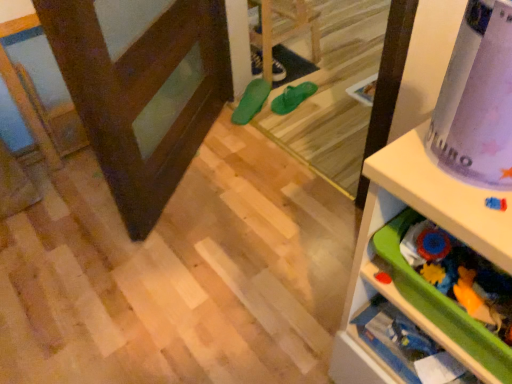
Image resolution: width=512 pixels, height=384 pixels. Describe the element at coordinates (140, 95) in the screenshot. I see `dark brown wood screen door at left` at that location.

Where is `green rubber flip-flops at center`? green rubber flip-flops at center is located at coordinates (281, 35).

What are the coordinates of `dark brown wood screen door at left` in the screenshot? It's located at (140, 95).

Is dark brown wood screen door at left facing away from green plastic drawer at lower right, which is counted as the 2th shelf, starting from the front?

dark brown wood screen door at left does not have its back to green plastic drawer at lower right, which is counted as the 2th shelf, starting from the front.

Between dark brown wood screen door at left and green plastic drawer at lower right, which is counted as the 2th shelf, starting from the front, which one appears on the left side from the viewer's perspective?

dark brown wood screen door at left is more to the left.

In terms of height, does dark brown wood screen door at left look taller or shorter compared to green plastic drawer at lower right, which appears as the 1th shelf when viewed from the back?

dark brown wood screen door at left is taller than green plastic drawer at lower right, which appears as the 1th shelf when viewed from the back.

Are dark brown wood screen door at left and green plastic drawer at lower right, which appears as the 1th shelf when viewed from the back, far apart?

dark brown wood screen door at left is actually quite close to green plastic drawer at lower right, which appears as the 1th shelf when viewed from the back.

From a real-world perspective, which object stands above the other?

purple matte wrapping paper at upper right is physically above.

Considering the points (453, 159) and (362, 239), which point is in front, point (453, 159) or point (362, 239)?

The point (453, 159) is in front.

From the image's perspective, is purple matte wrapping paper at upper right located beneath white plastic shelf at upper right, which appears as the second shelf when viewed from the back?

Actually, purple matte wrapping paper at upper right appears above white plastic shelf at upper right, which appears as the second shelf when viewed from the back, in the image.

In the image, there is a white plastic shelf at upper right, which is the 1th shelf from front to back. Identify the location of wrapping paper above it (from the image's perspective). coord(477,100).

How many degrees apart are the facing directions of green plastic drawer at lower right, which appears as the 1th shelf when viewed from the back, and green rubber shoe at center, which appears as the third footwear when viewed from the back?

green plastic drawer at lower right, which appears as the 1th shelf when viewed from the back, and green rubber shoe at center, which appears as the third footwear when viewed from the back, are facing 154 degrees away from each other.

In the image, is green plastic drawer at lower right, which appears as the 1th shelf when viewed from the back, positioned in front of or behind green rubber shoe at center, which appears as the third footwear when viewed from the back?

Clearly, green plastic drawer at lower right, which appears as the 1th shelf when viewed from the back, is in front of green rubber shoe at center, which appears as the third footwear when viewed from the back.

In the image, is green plastic drawer at lower right, which appears as the 1th shelf when viewed from the back, on the left side or the right side of green rubber shoe at center, the first footwear when ordered from front to back?

Based on their positions, green plastic drawer at lower right, which appears as the 1th shelf when viewed from the back, is located to the right of green rubber shoe at center, the first footwear when ordered from front to back.

Does point (465, 348) appear closer or farther from the camera than point (247, 107)?

Point (465, 348).

From the image's perspective, is purple matte wrapping paper at upper right above or below dark brown wood screen door at left?

purple matte wrapping paper at upper right is below dark brown wood screen door at left.

Considering the relative positions of purple matte wrapping paper at upper right and dark brown wood screen door at left in the image provided, is purple matte wrapping paper at upper right to the left or to the right of dark brown wood screen door at left?

purple matte wrapping paper at upper right is positioned on dark brown wood screen door at left's right side.

Is purple matte wrapping paper at upper right not near dark brown wood screen door at left?

Yes, purple matte wrapping paper at upper right and dark brown wood screen door at left are quite far apart.

Locate an element on the screen. The image size is (512, 384). wrapping paper below the matte black shoe at center, which ranks as the 3th footwear in front-to-back order (from the image's perspective) is located at coordinates (477, 100).

Who is bigger, purple matte wrapping paper at upper right or matte black shoe at center, the first footwear when ordered from back to front?

purple matte wrapping paper at upper right is bigger.

Is purple matte wrapping paper at upper right inside the boundaries of matte black shoe at center, which ranks as the 3th footwear in front-to-back order, or outside?

purple matte wrapping paper at upper right lies outside matte black shoe at center, which ranks as the 3th footwear in front-to-back order.

Is purple matte wrapping paper at upper right facing towards matte black shoe at center, the first footwear when ordered from back to front?

No, purple matte wrapping paper at upper right is not facing towards matte black shoe at center, the first footwear when ordered from back to front.

Considering the points (84, 24) and (464, 215), which point is in front, point (84, 24) or point (464, 215)?

The point (464, 215) is closer to the camera.

Is dark brown wood screen door at left not close to white plastic shelf at upper right, which appears as the second shelf when viewed from the back?

That's not correct — dark brown wood screen door at left is a little close to white plastic shelf at upper right, which appears as the second shelf when viewed from the back.

Considering the sizes of green rubber flip-flops at center, the 2th footwear positioned from the back, and green rubber shoe at center, which appears as the third footwear when viewed from the back, in the image, is green rubber flip-flops at center, the 2th footwear positioned from the back, wider or thinner than green rubber shoe at center, which appears as the third footwear when viewed from the back,?

green rubber flip-flops at center, the 2th footwear positioned from the back, is thinner than green rubber shoe at center, which appears as the third footwear when viewed from the back.

From the picture: Can you tell me how much green rubber flip-flops at center, which ranks as the 2th footwear in front-to-back order, and green rubber shoe at center, the first footwear when ordered from front to back, differ in facing direction?

17.2 degrees separate the facing orientations of green rubber flip-flops at center, which ranks as the 2th footwear in front-to-back order, and green rubber shoe at center, the first footwear when ordered from front to back.

In the scene shown: From the image's perspective, is green rubber flip-flops at center, which ranks as the 2th footwear in front-to-back order, on green rubber shoe at center, the first footwear when ordered from front to back?

Indeed, from the image's perspective, green rubber flip-flops at center, which ranks as the 2th footwear in front-to-back order, is shown above green rubber shoe at center, the first footwear when ordered from front to back.

Visually, is green rubber flip-flops at center, which ranks as the 2th footwear in front-to-back order, positioned to the left or to the right of green rubber shoe at center, the first footwear when ordered from front to back?

From the image, it's evident that green rubber flip-flops at center, which ranks as the 2th footwear in front-to-back order, is to the right of green rubber shoe at center, the first footwear when ordered from front to back.

Image resolution: width=512 pixels, height=384 pixels. Find the location of `shelf that is the 1st object to the right of the dark brown wood screen door at left, starting at the anchor`. shelf that is the 1st object to the right of the dark brown wood screen door at left, starting at the anchor is located at coordinates (439, 301).

The image size is (512, 384). In order to click on wrapping paper above the white plastic shelf at upper right, which appears as the second shelf when viewed from the back (from a real-world perspective) in this screenshot , I will do `click(477, 100)`.

From the picture: Which object lies nearer to the anchor point green rubber flip-flops at center, white plastic shelf at upper right, which is the 1th shelf from front to back, or green rubber shoe at center, the first footwear when ordered from front to back?

green rubber shoe at center, the first footwear when ordered from front to back, is closer to green rubber flip-flops at center.

Based on their spatial positions, is dark brown wood screen door at left or green plastic drawer at lower right, which is counted as the 2th shelf, starting from the front, further from green rubber shoe at center, the first footwear when ordered from front to back?

green plastic drawer at lower right, which is counted as the 2th shelf, starting from the front, is further to green rubber shoe at center, the first footwear when ordered from front to back.

From the image, which object appears to be farther from matte black shoe at center, which ranks as the 3th footwear in front-to-back order, green rubber flip-flops at center, which ranks as the 2th footwear in front-to-back order, or green plastic drawer at lower right, which appears as the 1th shelf when viewed from the back?

green plastic drawer at lower right, which appears as the 1th shelf when viewed from the back, is positioned further to the anchor matte black shoe at center, which ranks as the 3th footwear in front-to-back order.

Estimate the real-world distances between objects in this image. Which object is further from matte black shoe at center, the first footwear when ordered from back to front, dark brown wood screen door at left or purple matte wrapping paper at upper right?

purple matte wrapping paper at upper right is positioned further to the anchor matte black shoe at center, the first footwear when ordered from back to front.

When comparing their distances from matte black shoe at center, which ranks as the 3th footwear in front-to-back order, does green rubber flip-flops at center, which ranks as the 2th footwear in front-to-back order, or green rubber shoe at center, the first footwear when ordered from front to back, seem further?

green rubber flip-flops at center, which ranks as the 2th footwear in front-to-back order, lies further to matte black shoe at center, which ranks as the 3th footwear in front-to-back order, than the other object.

Which object lies further to the anchor point white plastic shelf at upper right, which is the 1th shelf from front to back, green rubber flip-flops at center or matte black shoe at center, the first footwear when ordered from back to front?

Based on the image, matte black shoe at center, the first footwear when ordered from back to front, appears to be further to white plastic shelf at upper right, which is the 1th shelf from front to back.

Which object lies nearer to the anchor point white plastic shelf at upper right, which appears as the second shelf when viewed from the back, green plastic drawer at lower right, which is counted as the 2th shelf, starting from the front, or dark brown wood screen door at left?

green plastic drawer at lower right, which is counted as the 2th shelf, starting from the front, is positioned closer to the anchor white plastic shelf at upper right, which appears as the second shelf when viewed from the back.

Looking at the image, which one is located further to matte black shoe at center, the first footwear when ordered from back to front, green plastic drawer at lower right, which is counted as the 2th shelf, starting from the front, or dark brown wood screen door at left?

Based on the image, green plastic drawer at lower right, which is counted as the 2th shelf, starting from the front, appears to be further to matte black shoe at center, the first footwear when ordered from back to front.

This screenshot has width=512, height=384. What are the coordinates of `furniture between green plastic drawer at lower right, which appears as the 1th shelf when viewed from the back, and matte black shoe at center, the first footwear when ordered from back to front, along the z-axis` in the screenshot? It's located at (x=281, y=35).

Where is `furniture between dark brown wood screen door at left and green rubber shoe at center, which appears as the third footwear when viewed from the back, along the z-axis`? furniture between dark brown wood screen door at left and green rubber shoe at center, which appears as the third footwear when viewed from the back, along the z-axis is located at coordinates (281, 35).

The height and width of the screenshot is (384, 512). Find the location of `furniture positioned between purple matte wrapping paper at upper right and matte black shoe at center, the first footwear when ordered from back to front, from near to far`. furniture positioned between purple matte wrapping paper at upper right and matte black shoe at center, the first footwear when ordered from back to front, from near to far is located at coordinates (281, 35).

This screenshot has height=384, width=512. In order to click on furniture between green plastic drawer at lower right, which is counted as the 2th shelf, starting from the front, and green rubber shoe at center, the first footwear when ordered from front to back, in the front-back direction in this screenshot , I will do `click(281, 35)`.